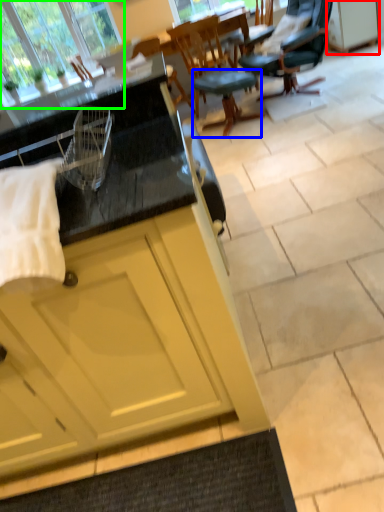
Question: Estimate the real-world distances between objects in this image. Which object is closer to cabinetry (highlighted by a red box), stool (highlighted by a blue box) or window (highlighted by a green box)?

Choices:
 (A) stool
 (B) window

Answer: (A)